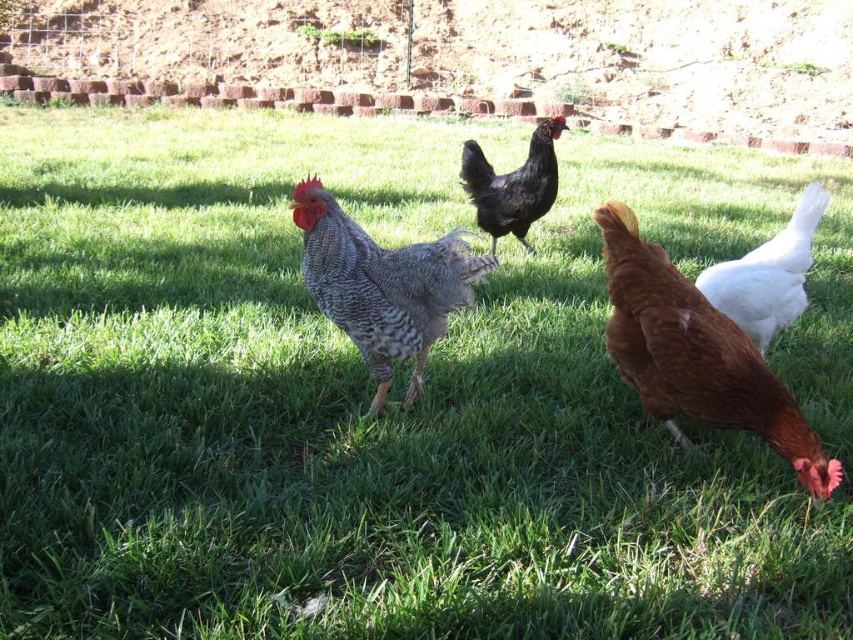
Question: Among these objects, which one is nearest to the camera?

Choices:
 (A) brown matte chicken at lower right
 (B) black glossy chicken at center
 (C) white glossy chicken at center

Answer: (A)

Question: Which object is positioned closest to the brown matte chicken at lower right?

Choices:
 (A) black glossy chicken at center
 (B) white glossy chicken at center
 (C) speckled feathered rooster at center

Answer: (B)

Question: Observing the image, what is the correct spatial positioning of speckled feathered rooster at center in reference to black glossy chicken at center?

Choices:
 (A) above
 (B) below

Answer: (B)

Question: Is brown matte chicken at lower right thinner than speckled feathered rooster at center?

Choices:
 (A) yes
 (B) no

Answer: (B)

Question: Which of the following is the closest to the observer?

Choices:
 (A) (550, 188)
 (B) (715, 282)
 (C) (424, 257)
 (D) (625, 273)

Answer: (D)

Question: Can you confirm if brown matte chicken at lower right is positioned below white glossy chicken at center?

Choices:
 (A) yes
 (B) no

Answer: (A)